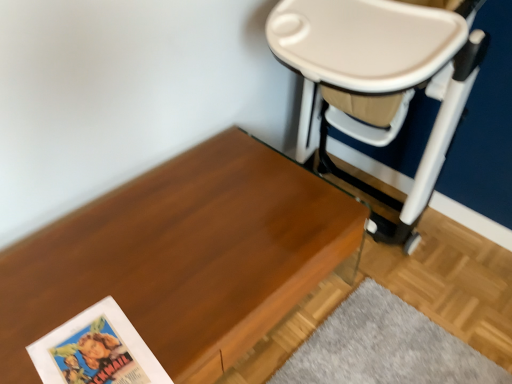
Question: Considering the positions of matte paper paperback book at lower left and beige plastic swivel chair at upper right in the image, is matte paper paperback book at lower left bigger or smaller than beige plastic swivel chair at upper right?

Choices:
 (A) big
 (B) small

Answer: (B)

Question: From a real-world perspective, is matte paper paperback book at lower left above or below beige plastic swivel chair at upper right?

Choices:
 (A) above
 (B) below

Answer: (B)

Question: Based on their relative distances, which object is farther from the beige plastic swivel chair at upper right?

Choices:
 (A) wooden table at lower left
 (B) matte paper paperback book at lower left

Answer: (B)

Question: Based on their relative distances, which object is nearer to the beige plastic swivel chair at upper right?

Choices:
 (A) wooden table at lower left
 (B) matte paper paperback book at lower left

Answer: (A)